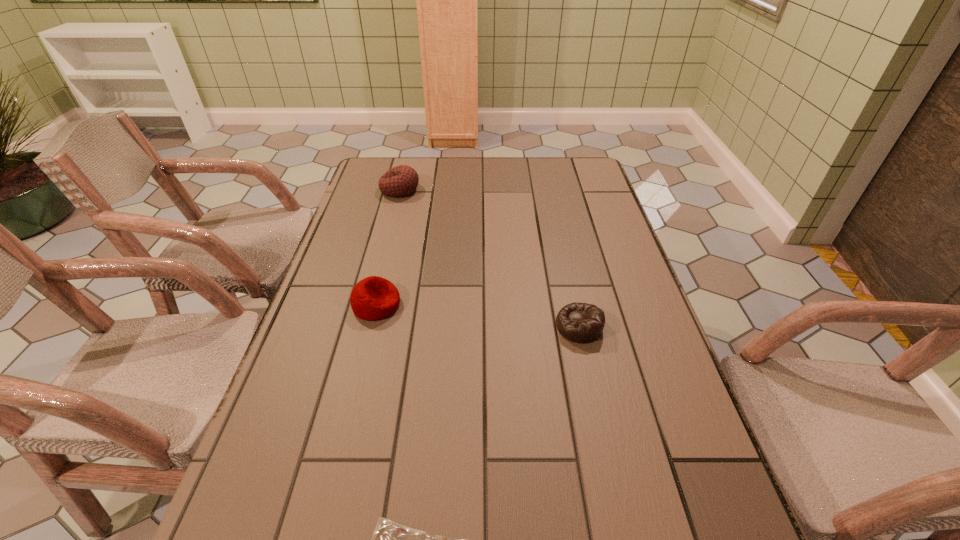
This screenshot has width=960, height=540. In order to click on vacant space at the far edge of the desktop in this screenshot , I will do `click(426, 176)`.

This screenshot has height=540, width=960. Identify the location of free space at the left edge of the desktop. (336, 326).

Find the location of `free space at the right edge of the desktop`. free space at the right edge of the desktop is located at coordinates (660, 357).

This screenshot has height=540, width=960. Identify the location of vacant area that lies between the farthest object and the third shortest object. (388, 247).

You are a GUI agent. You are given a task and a screenshot of the screen. Output one action in this format:
    pyautogui.click(x=<x>, y=<y>)
    Task: Click on the vacant region between the second shortest object and the farthest beanbag
    
    Given the screenshot: What is the action you would take?
    pyautogui.click(x=490, y=258)

Locate an element on the screen. Image resolution: width=960 pixels, height=540 pixels. vacant area between the farthest object and the third shortest object is located at coordinates (388, 247).

Where is `vacant space in between the farthest beanbag and the shortest beanbag`? vacant space in between the farthest beanbag and the shortest beanbag is located at coordinates (490, 258).

Where is `blank region between the farthest object and the shortest beanbag`? blank region between the farthest object and the shortest beanbag is located at coordinates (490, 258).

The width and height of the screenshot is (960, 540). I want to click on empty space that is in between the second tallest object and the farthest beanbag, so click(388, 247).

Where is `object that is the nearest to the rightmost beanbag`? object that is the nearest to the rightmost beanbag is located at coordinates (373, 298).